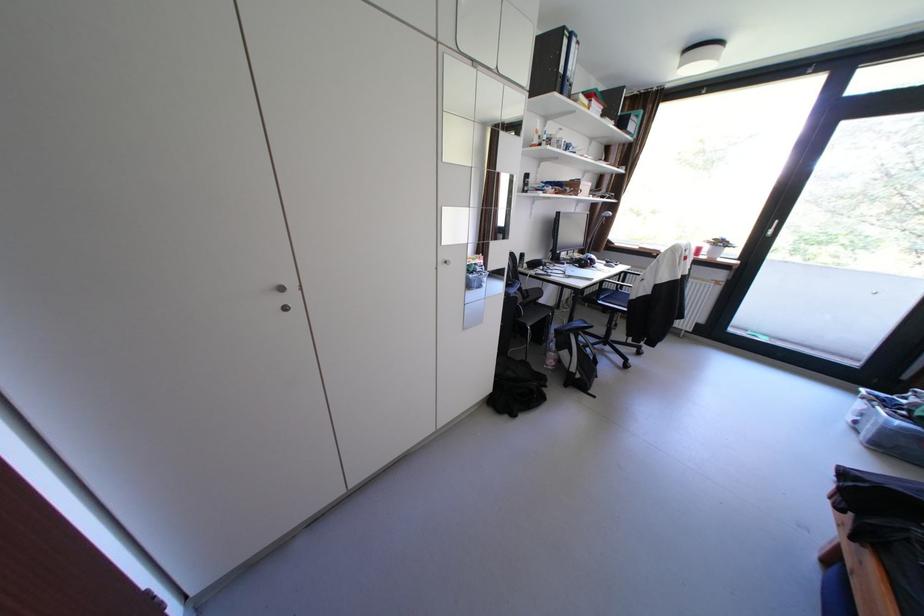
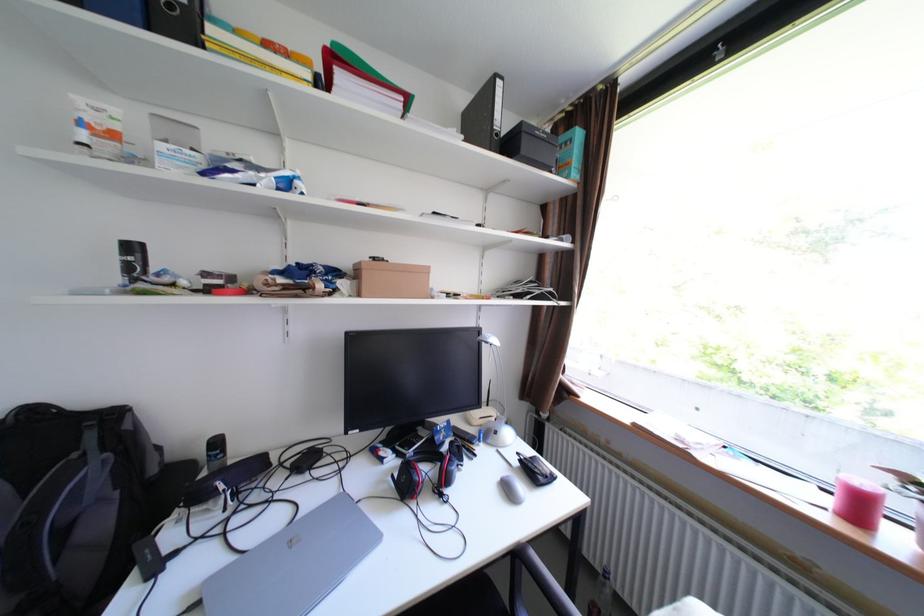
In the second image, find the point that corresponds to pixel 538 177 in the first image.

(143, 248)